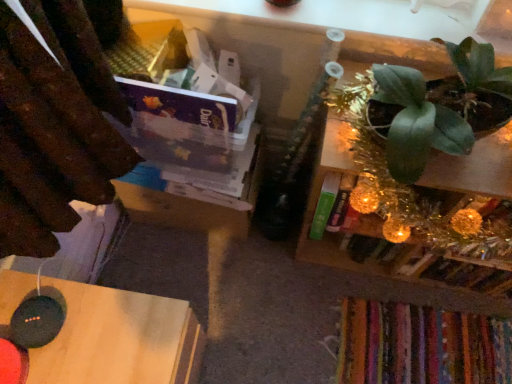
Question: Can you confirm if green metallic plant at upper right is thinner than black wood table at lower left?

Choices:
 (A) no
 (B) yes

Answer: (B)

Question: Is green metallic plant at upper right beside black wood table at lower left?

Choices:
 (A) no
 (B) yes

Answer: (A)

Question: From a real-world perspective, is green metallic plant at upper right physically below black wood table at lower left?

Choices:
 (A) yes
 (B) no

Answer: (B)

Question: Does green metallic plant at upper right have a greater height compared to black wood table at lower left?

Choices:
 (A) no
 (B) yes

Answer: (B)

Question: Does green metallic plant at upper right appear on the left side of black wood table at lower left?

Choices:
 (A) no
 (B) yes

Answer: (A)

Question: Could you tell me if green metallic plant at upper right is facing black wood table at lower left?

Choices:
 (A) no
 (B) yes

Answer: (A)

Question: Is green metallic plant at upper right located outside green matte plant at upper right?

Choices:
 (A) no
 (B) yes

Answer: (B)

Question: From the image's perspective, is green metallic plant at upper right under green matte plant at upper right?

Choices:
 (A) no
 (B) yes

Answer: (B)

Question: Are green metallic plant at upper right and green matte plant at upper right beside each other?

Choices:
 (A) yes
 (B) no

Answer: (B)

Question: From the image's perspective, is green metallic plant at upper right on green matte plant at upper right?

Choices:
 (A) yes
 (B) no

Answer: (B)

Question: Is green metallic plant at upper right shorter than green matte plant at upper right?

Choices:
 (A) yes
 (B) no

Answer: (B)

Question: From a real-world perspective, is green metallic plant at upper right physically above green matte plant at upper right?

Choices:
 (A) yes
 (B) no

Answer: (B)

Question: Is green matte plant at upper right positioned with its back to green metallic plant at upper right?

Choices:
 (A) no
 (B) yes

Answer: (A)